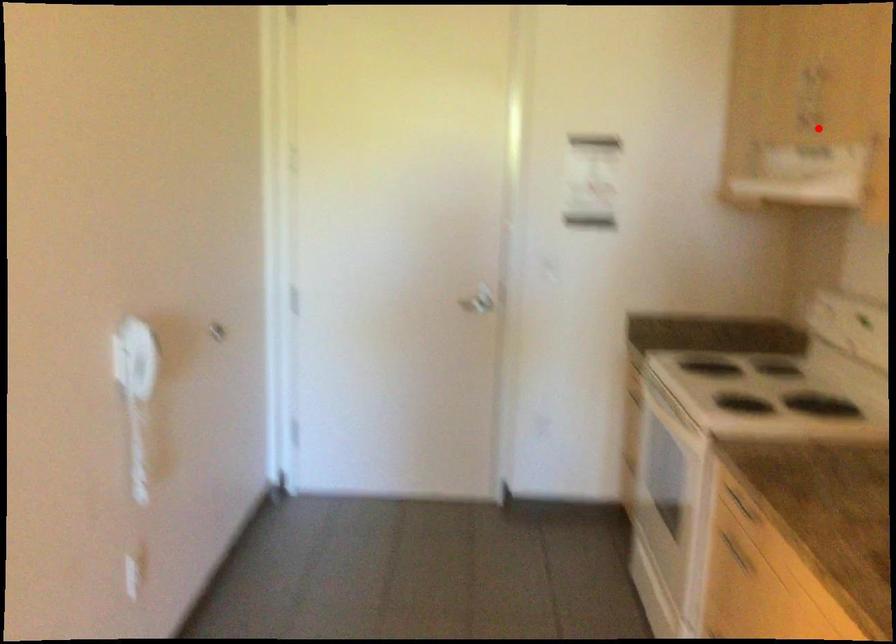
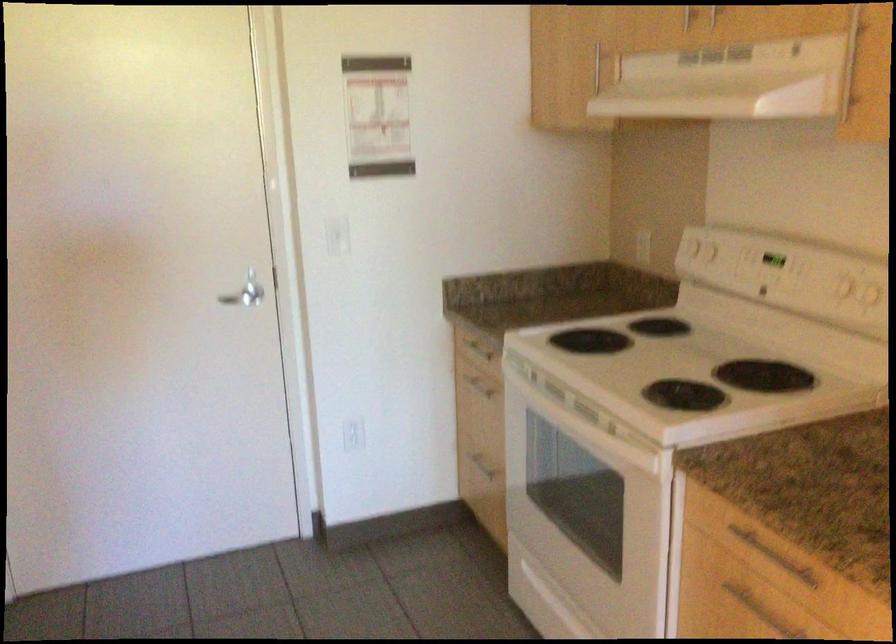
Question: I am providing you with two images of the same scene from different viewpoints. A red point is marked on the first image. At the location where the point appears in image 1, is it still visible in image 2?

Choices:
 (A) Yes
 (B) No

Answer: (A)